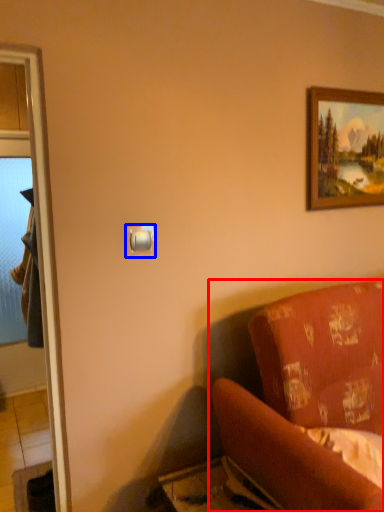
Question: Among these objects, which one is nearest to the camera, studio couch (highlighted by a red box) or light switch (highlighted by a blue box)?

Choices:
 (A) studio couch
 (B) light switch

Answer: (A)